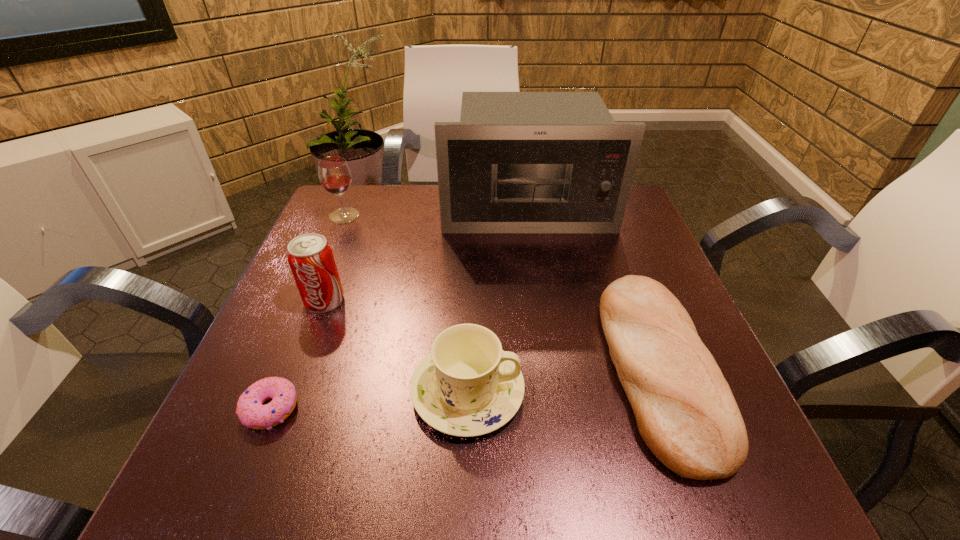
Locate an element on the screen. The height and width of the screenshot is (540, 960). unoccupied position between the bread and the tallest object is located at coordinates (591, 288).

I want to click on vacant area that lies between the chinaware and the soda can, so click(396, 346).

The width and height of the screenshot is (960, 540). In order to click on empty space that is in between the soda can and the doughnut in this screenshot , I will do `click(298, 355)`.

This screenshot has height=540, width=960. Find the location of `vacant space that is in between the chinaware and the tallest object`. vacant space that is in between the chinaware and the tallest object is located at coordinates (497, 300).

Locate an element on the screen. This screenshot has width=960, height=540. empty location between the tallest object and the chinaware is located at coordinates (497, 300).

Where is `free space between the doughnut and the microwave oven`? free space between the doughnut and the microwave oven is located at coordinates 398,308.

You are a GUI agent. You are given a task and a screenshot of the screen. Output one action in this format:
    pyautogui.click(x=<x>, y=<y>)
    Task: Click on the object that is the second closest to the microwave oven
    The width and height of the screenshot is (960, 540).
    Given the screenshot: What is the action you would take?
    pyautogui.click(x=334, y=173)

The height and width of the screenshot is (540, 960). Identify the location of object that is the third closest to the soda can. (334, 173).

The image size is (960, 540). Identify the location of free point that satisfies the following two spatial constraints: 1. on the front side of the soda can; 2. on the left side of the bread. (299, 368).

This screenshot has width=960, height=540. Find the location of `vacant space that satisfies the following two spatial constraints: 1. on the front-facing side of the microwave oven; 2. on the left side of the bread`. vacant space that satisfies the following two spatial constraints: 1. on the front-facing side of the microwave oven; 2. on the left side of the bread is located at coordinates (550, 368).